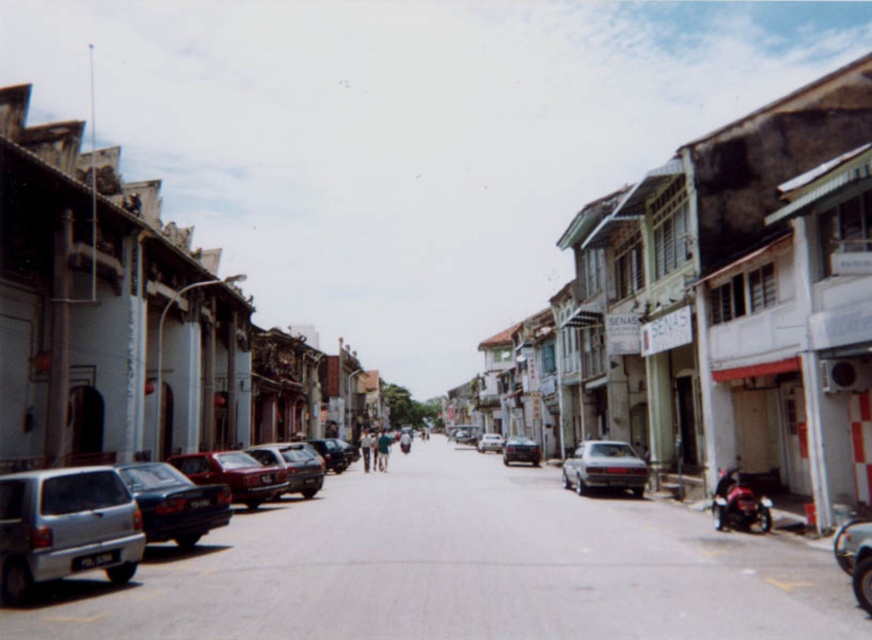
You are standing at the intersection of the street and want to locate the silver metallic car at lower left. According to the coordinate system where the bottom left corner is the origin, can you confirm if the point at (65, 528) is the correct location for the silver metallic car at lower left?

Yes, the point at (65, 528) corresponds to the silver metallic car at lower left as per the coordinate system described.

You are standing at the center of the street and see a point marked at coordinates (233, 474). Based on the scene description, what object is located at that point?

The point at coordinates (233, 474) indicates a shiny red car at left.

You are a delivery driver who needs to park your car at the address located at point [87,522]. The parking space there is 2.5 meters wide. Your delivery van is 2.3 meters wide. Can you safely park your van in that space?

The parking space at point [87,522] is 2.5 meters wide, and your van is 2.3 meters wide. Since the space is wider than your vehicle, you can safely park your van there.